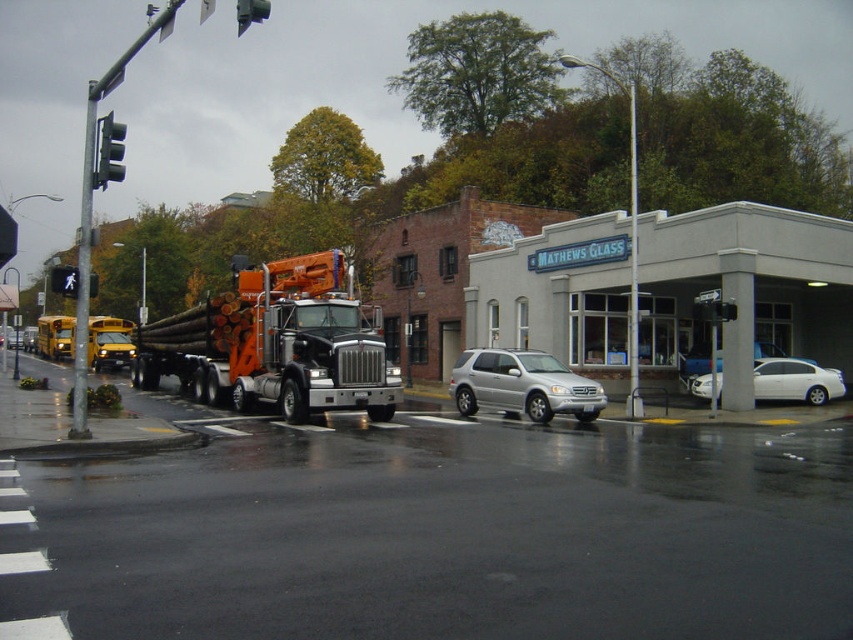
Who is positioned more to the right, black glass traffic light at upper left or black plastic traffic light at upper left?

From the viewer's perspective, black plastic traffic light at upper left appears more on the right side.

The width and height of the screenshot is (853, 640). What do you see at coordinates (109, 150) in the screenshot?
I see `black glass traffic light at upper left` at bounding box center [109, 150].

Between point (122, 176) and point (64, 289), which one is positioned in front?

Positioned in front is point (64, 289).

Find the location of a particular element. The height and width of the screenshot is (640, 853). black glass traffic light at upper left is located at coordinates (109, 150).

The image size is (853, 640). What do you see at coordinates (109, 348) in the screenshot?
I see `yellow school bus at left` at bounding box center [109, 348].

Who is more distant from viewer, (126, 330) or (242, 12)?

Positioned behind is point (126, 330).

Between point (109, 342) and point (241, 8), which one is positioned behind?

The point (109, 342) is more distant.

Where is `yellow school bus at left`? yellow school bus at left is located at coordinates (109, 348).

Does orange metallic truck at center come in front of black plastic traffic light at upper left?

No, orange metallic truck at center is behind black plastic traffic light at upper left.

Where is `orange metallic truck at center`? The image size is (853, 640). orange metallic truck at center is located at coordinates (276, 342).

Find the location of a particular element. The image size is (853, 640). orange metallic truck at center is located at coordinates (276, 342).